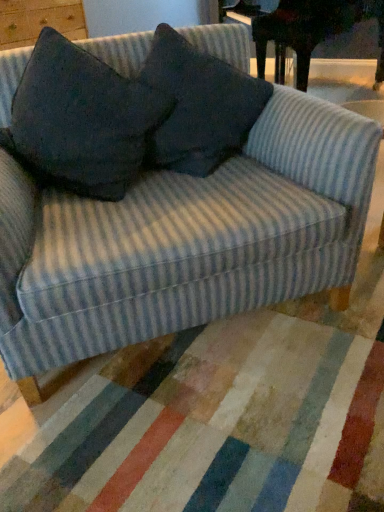
The width and height of the screenshot is (384, 512). Describe the element at coordinates (198, 106) in the screenshot. I see `dark fabric pillow at center, which is the 1th throw pillow from right to left` at that location.

This screenshot has width=384, height=512. Describe the element at coordinates (305, 29) in the screenshot. I see `dark wood piano at upper right` at that location.

Measure the distance between point (143, 145) and camera.

Point (143, 145) and camera are 4.47 feet apart.

What are the coordinates of `dark fabric pillow at center, which is the 1th throw pillow from right to left` in the screenshot? It's located at (198, 106).

Would you say dark gray fabric pillow at upper center, which is counted as the 1th throw pillow, starting from the left, is part of dark fabric pillow at center, which is the 1th throw pillow from right to left,'s contents?

No, dark gray fabric pillow at upper center, which is counted as the 1th throw pillow, starting from the left, is not a part of dark fabric pillow at center, which is the 1th throw pillow from right to left.

From the picture: Does dark fabric pillow at center, which is the second throw pillow from left to right, appear on the right side of dark gray fabric pillow at upper center, which appears as the 2th throw pillow when viewed from the right?

Yes.

Considering the sizes of objects dark fabric pillow at center, which is the 1th throw pillow from right to left, and dark gray fabric pillow at upper center, which appears as the 2th throw pillow when viewed from the right, in the image provided, who is thinner, dark fabric pillow at center, which is the 1th throw pillow from right to left, or dark gray fabric pillow at upper center, which appears as the 2th throw pillow when viewed from the right,?

dark fabric pillow at center, which is the 1th throw pillow from right to left, is thinner.

Which is behind, point (160, 147) or point (87, 147)?

The point (160, 147) is farther.

Is dark fabric pillow at center, which is the second throw pillow from left to right, wider or thinner than dark wood piano at upper right?

In the image, dark fabric pillow at center, which is the second throw pillow from left to right, appears to be more narrow than dark wood piano at upper right.

Would you say dark fabric pillow at center, which is the second throw pillow from left to right, is outside dark wood piano at upper right?

Indeed, dark fabric pillow at center, which is the second throw pillow from left to right, is completely outside dark wood piano at upper right.

From a real-world perspective, which throw pillow is the 1st one above the dark wood piano at upper right? Please provide its 2D coordinates.

[(198, 106)]

Considering the relative sizes of dark fabric pillow at center, which is the second throw pillow from left to right, and dark wood piano at upper right in the image provided, is dark fabric pillow at center, which is the second throw pillow from left to right, smaller than dark wood piano at upper right?

Correct, dark fabric pillow at center, which is the second throw pillow from left to right, occupies less space than dark wood piano at upper right.

Based on the photo, is dark gray fabric pillow at upper center, which is counted as the 1th throw pillow, starting from the left, completely or partially outside of dark wood piano at upper right?

Yes, dark gray fabric pillow at upper center, which is counted as the 1th throw pillow, starting from the left, is not within dark wood piano at upper right.

From their relative heights in the image, would you say dark gray fabric pillow at upper center, which appears as the 2th throw pillow when viewed from the right, is taller or shorter than dark wood piano at upper right?

Considering their sizes, dark gray fabric pillow at upper center, which appears as the 2th throw pillow when viewed from the right, has less height than dark wood piano at upper right.

You are a GUI agent. You are given a task and a screenshot of the screen. Output one action in this format:
    pyautogui.click(x=<x>, y=<y>)
    Task: Click on the table above the dark gray fabric pillow at upper center, which appears as the 2th throw pillow when viewed from the right (from the image's perspective)
    
    Given the screenshot: What is the action you would take?
    tap(305, 29)

You are a GUI agent. You are given a task and a screenshot of the screen. Output one action in this format:
    pyautogui.click(x=<x>, y=<y>)
    Task: Click on the throw pillow that is behind the dark gray fabric pillow at upper center, which is counted as the 1th throw pillow, starting from the left
    The height and width of the screenshot is (512, 384).
    Given the screenshot: What is the action you would take?
    pyautogui.click(x=198, y=106)

From their relative heights in the image, would you say dark gray fabric pillow at upper center, which is counted as the 1th throw pillow, starting from the left, is taller or shorter than dark fabric pillow at center, which is the 1th throw pillow from right to left?

Clearly, dark gray fabric pillow at upper center, which is counted as the 1th throw pillow, starting from the left, is taller compared to dark fabric pillow at center, which is the 1th throw pillow from right to left.

In the image, is dark gray fabric pillow at upper center, which is counted as the 1th throw pillow, starting from the left, on the left side or the right side of dark fabric pillow at center, which is the 1th throw pillow from right to left?

Based on their positions, dark gray fabric pillow at upper center, which is counted as the 1th throw pillow, starting from the left, is located to the left of dark fabric pillow at center, which is the 1th throw pillow from right to left.

Is dark wood piano at upper right oriented away from dark gray fabric pillow at upper center, which appears as the 2th throw pillow when viewed from the right?

That's not correct — dark wood piano at upper right is not looking away from dark gray fabric pillow at upper center, which appears as the 2th throw pillow when viewed from the right.

Who is smaller, dark wood piano at upper right or dark gray fabric pillow at upper center, which is counted as the 1th throw pillow, starting from the left?

Smaller between the two is dark gray fabric pillow at upper center, which is counted as the 1th throw pillow, starting from the left.

Where is `the 2nd throw pillow to the left when counting from the dark wood piano at upper right`? Image resolution: width=384 pixels, height=512 pixels. the 2nd throw pillow to the left when counting from the dark wood piano at upper right is located at coordinates (81, 120).

Considering the relative positions of dark wood piano at upper right and dark gray fabric pillow at upper center, which is counted as the 1th throw pillow, starting from the left, in the image provided, is dark wood piano at upper right to the left of dark gray fabric pillow at upper center, which is counted as the 1th throw pillow, starting from the left, from the viewer's perspective?

In fact, dark wood piano at upper right is to the right of dark gray fabric pillow at upper center, which is counted as the 1th throw pillow, starting from the left.

From a real-world perspective, which is physically above, dark wood piano at upper right or dark fabric pillow at center, which is the second throw pillow from left to right?

In real-world perspective, dark fabric pillow at center, which is the second throw pillow from left to right, is above.

From the image's perspective, is dark wood piano at upper right above or below dark fabric pillow at center, which is the second throw pillow from left to right?

dark wood piano at upper right is situated higher than dark fabric pillow at center, which is the second throw pillow from left to right, in the image.

Is dark wood piano at upper right far away from dark fabric pillow at center, which is the second throw pillow from left to right?

Indeed, dark wood piano at upper right is not near dark fabric pillow at center, which is the second throw pillow from left to right.

Considering the sizes of objects dark wood piano at upper right and dark fabric pillow at center, which is the 1th throw pillow from right to left, in the image provided, who is taller, dark wood piano at upper right or dark fabric pillow at center, which is the 1th throw pillow from right to left,?

dark wood piano at upper right is taller.

What are the coordinates of `throw pillow below the dark fabric pillow at center, which is the second throw pillow from left to right (from the image's perspective)` in the screenshot? It's located at (81, 120).

Image resolution: width=384 pixels, height=512 pixels. I want to click on table located behind the dark fabric pillow at center, which is the second throw pillow from left to right, so click(305, 29).

When comparing their distances from dark wood piano at upper right, does dark fabric pillow at center, which is the second throw pillow from left to right, or dark gray fabric pillow at upper center, which appears as the 2th throw pillow when viewed from the right, seem closer?

dark fabric pillow at center, which is the second throw pillow from left to right, lies closer to dark wood piano at upper right than the other object.

When comparing their distances from dark wood piano at upper right, does dark gray fabric pillow at upper center, which appears as the 2th throw pillow when viewed from the right, or dark fabric pillow at center, which is the 1th throw pillow from right to left, seem closer?

The object closer to dark wood piano at upper right is dark fabric pillow at center, which is the 1th throw pillow from right to left.

Considering their positions, is dark wood piano at upper right positioned further to dark gray fabric pillow at upper center, which is counted as the 1th throw pillow, starting from the left, than dark fabric pillow at center, which is the second throw pillow from left to right?

Based on the image, dark wood piano at upper right appears to be further to dark gray fabric pillow at upper center, which is counted as the 1th throw pillow, starting from the left.

Which object lies nearer to the anchor point dark fabric pillow at center, which is the second throw pillow from left to right, dark wood piano at upper right or dark gray fabric pillow at upper center, which is counted as the 1th throw pillow, starting from the left?

dark gray fabric pillow at upper center, which is counted as the 1th throw pillow, starting from the left, is positioned closer to the anchor dark fabric pillow at center, which is the second throw pillow from left to right.

From the image, which object appears to be farther from dark gray fabric pillow at upper center, which is counted as the 1th throw pillow, starting from the left, dark fabric pillow at center, which is the second throw pillow from left to right, or dark wood piano at upper right?

Based on the image, dark wood piano at upper right appears to be further to dark gray fabric pillow at upper center, which is counted as the 1th throw pillow, starting from the left.

Estimate the real-world distances between objects in this image. Which object is further from dark fabric pillow at center, which is the 1th throw pillow from right to left, dark gray fabric pillow at upper center, which is counted as the 1th throw pillow, starting from the left, or dark wood piano at upper right?

Among the two, dark wood piano at upper right is located further to dark fabric pillow at center, which is the 1th throw pillow from right to left.

I want to click on throw pillow located between dark gray fabric pillow at upper center, which appears as the 2th throw pillow when viewed from the right, and dark wood piano at upper right in the depth direction, so click(198, 106).